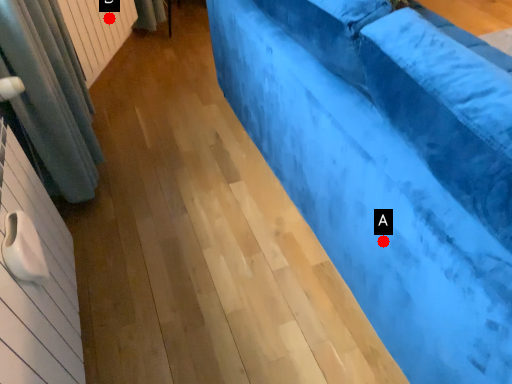
Question: Two points are circled on the image, labeled by A and B beside each circle. Which point is further to the camera?

Choices:
 (A) A is further
 (B) B is further

Answer: (B)